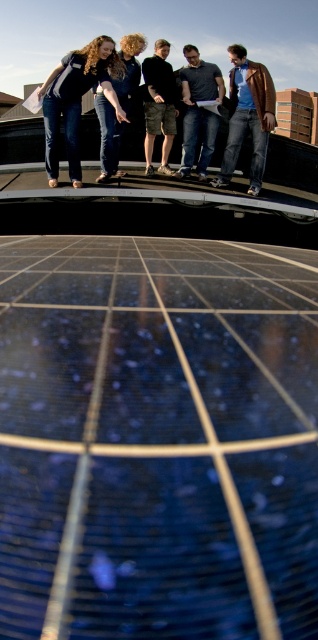
Question: Is brown leather jacket at upper right thinner than curly hair at center?

Choices:
 (A) no
 (B) yes

Answer: (A)

Question: Observing the image, what is the correct spatial positioning of denim jeans at center in reference to dark gray shirt at center?

Choices:
 (A) above
 (B) below

Answer: (B)

Question: Among these objects, which one is farthest from the camera?

Choices:
 (A) curly hair at center
 (B) denim jeans at center
 (C) brown leather jacket at upper right

Answer: (C)

Question: Among these points, which one is nearest to the camera?

Choices:
 (A) (129, 45)
 (B) (172, 140)
 (C) (48, 170)

Answer: (C)

Question: In this image, where is camouflage shorts at center located relative to curly hair at center?

Choices:
 (A) left
 (B) right

Answer: (B)

Question: Which object is farther from the camera taking this photo?

Choices:
 (A) curly hair at center
 (B) brown leather jacket at upper right
 (C) denim jeans at center
 (D) dark gray shirt at center

Answer: (D)